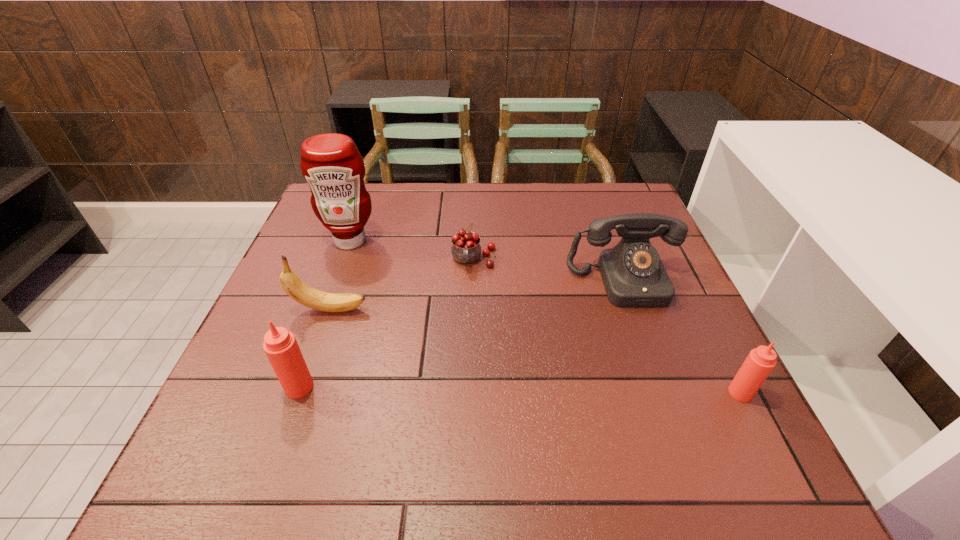
I want to click on free space that satisfies the following two spatial constraints: 1. on the dial of the shorter Tabasco sauce; 2. on the left side of the telephone, so click(663, 393).

This screenshot has width=960, height=540. What are the coordinates of `free space in the image that satisfies the following two spatial constraints: 1. on the handle side of the right Tabasco sauce; 2. on the left side of the fourth object from left to right` in the screenshot? It's located at (471, 393).